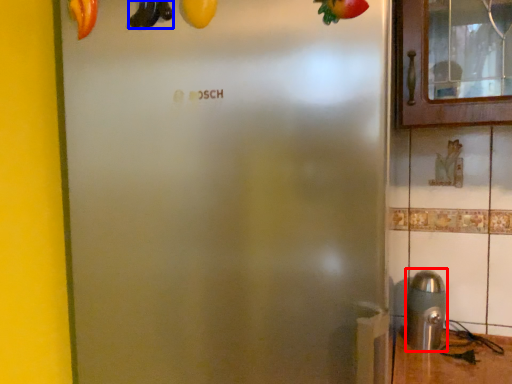
Question: Which of the following is the closest to the observer, stainless steel (highlighted by a red box) or banana (highlighted by a blue box)?

Choices:
 (A) stainless steel
 (B) banana

Answer: (B)